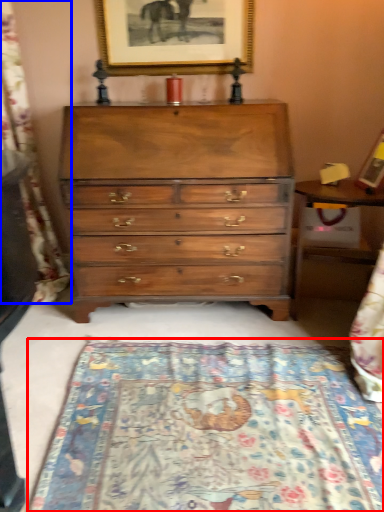
Question: Which object is further to the camera taking this photo, mat (highlighted by a red box) or tapestry (highlighted by a blue box)?

Choices:
 (A) mat
 (B) tapestry

Answer: (B)